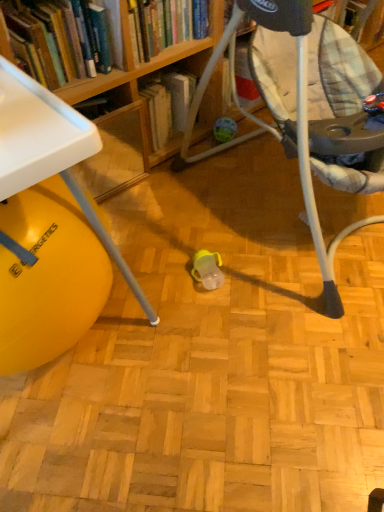
What are the coordinates of `free space in front of matte plastic baby swing at center` in the screenshot? It's located at (252, 379).